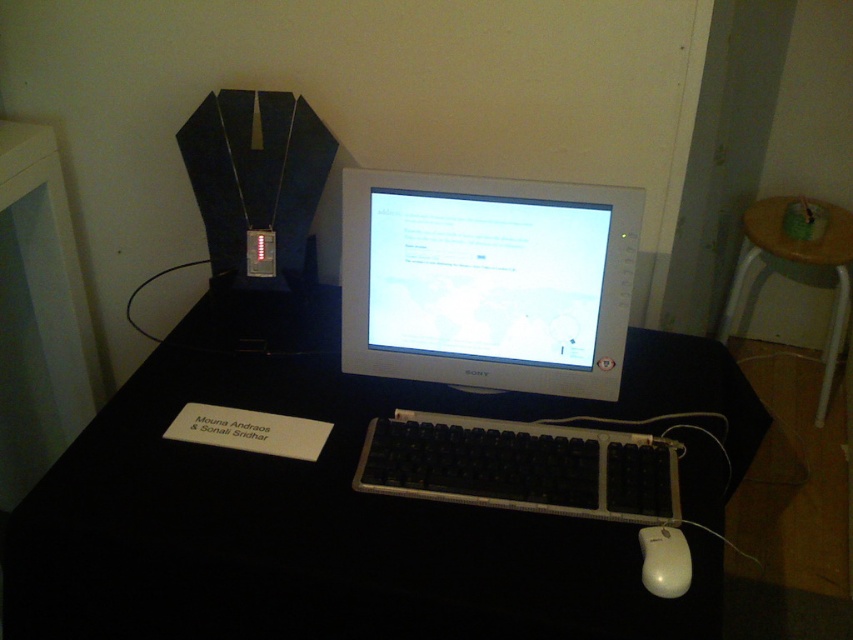
Question: Which point is farther to the camera?

Choices:
 (A) (689, 586)
 (B) (248, 509)

Answer: (B)

Question: Is the position of white glossy monitor at center more distant than that of wooden table at right?

Choices:
 (A) yes
 (B) no

Answer: (B)

Question: Which object is the closest to the white glossy monitor at center?

Choices:
 (A) black plastic computer desk at center
 (B) white plastic mouse at lower right

Answer: (A)

Question: Which of the following is the closest to the observer?

Choices:
 (A) (398, 273)
 (B) (770, 246)
 (C) (689, 452)
 (D) (646, 554)

Answer: (D)

Question: Is wooden table at right positioned behind white plastic mouse at lower right?

Choices:
 (A) yes
 (B) no

Answer: (A)

Question: Is black plastic keyboard at center in front of wooden table at right?

Choices:
 (A) yes
 (B) no

Answer: (A)